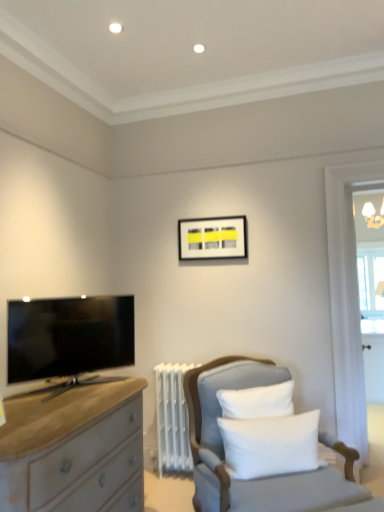
Question: Considering the positions of matte black tv at left and clear glass window at right in the image, is matte black tv at left taller or shorter than clear glass window at right?

Choices:
 (A) short
 (B) tall

Answer: (A)

Question: From a real-world perspective, relative to clear glass window at right, is matte black tv at left vertically above or below?

Choices:
 (A) below
 (B) above

Answer: (A)

Question: Which object is positioned closest to the light gray fabric chair at lower right?

Choices:
 (A) clear glass window at right
 (B) matte black picture frame at upper center
 (C) white soft cushion at center
 (D) matte black tv at left

Answer: (C)

Question: Which of these objects is positioned closest to the clear glass window at right?

Choices:
 (A) matte black tv at left
 (B) light gray fabric chair at lower right
 (C) matte black picture frame at upper center
 (D) white soft cushion at center

Answer: (C)